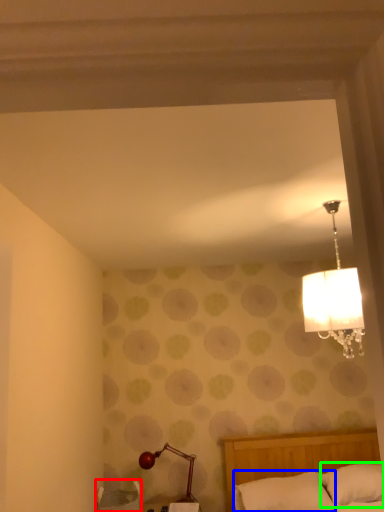
Question: Based on their relative distances, which object is farther from furniture (highlighted by a red box)? Choose from pillow (highlighted by a blue box) and pillow (highlighted by a green box).

Choices:
 (A) pillow
 (B) pillow

Answer: (B)